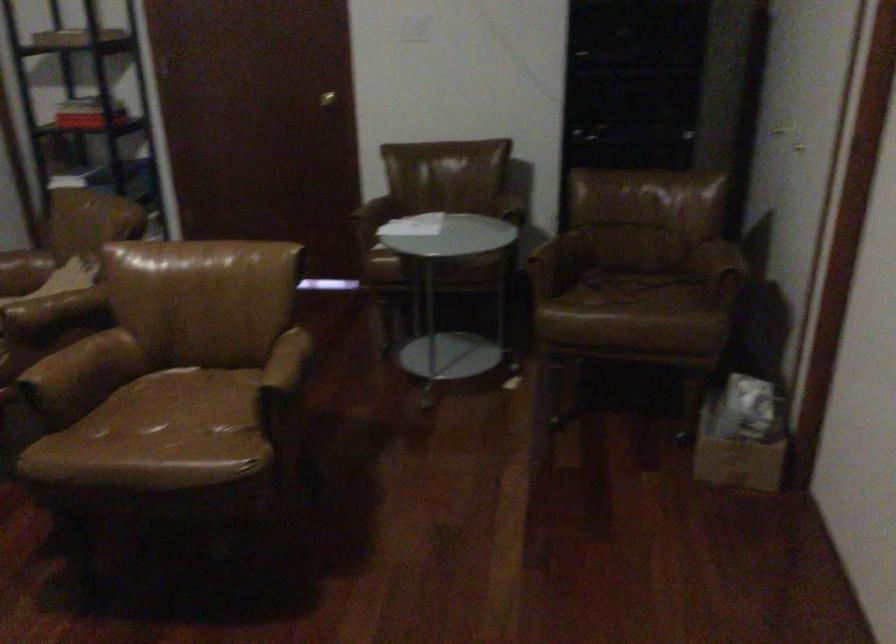
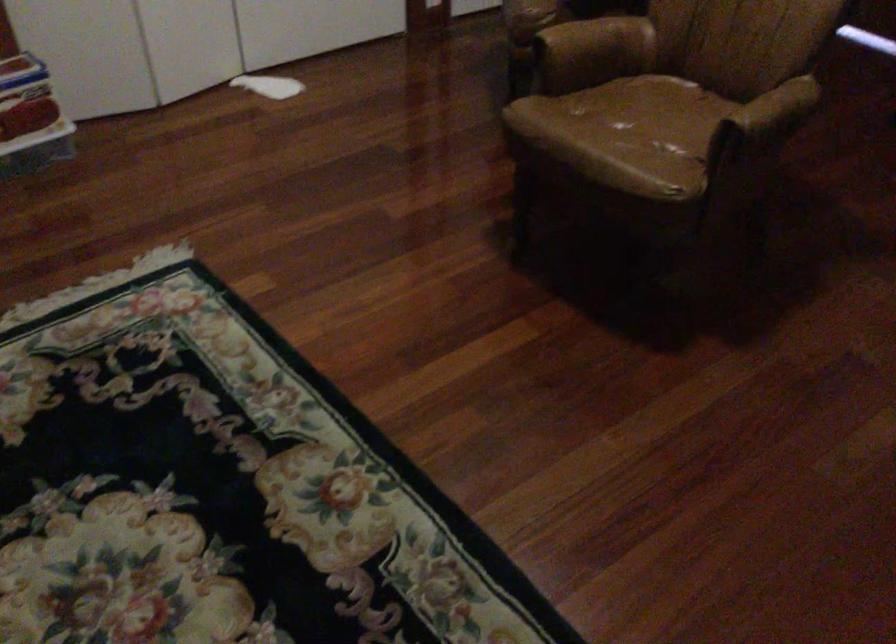
Where in the second image is the point corresponding to the point at 295,361 from the first image?

(776, 109)